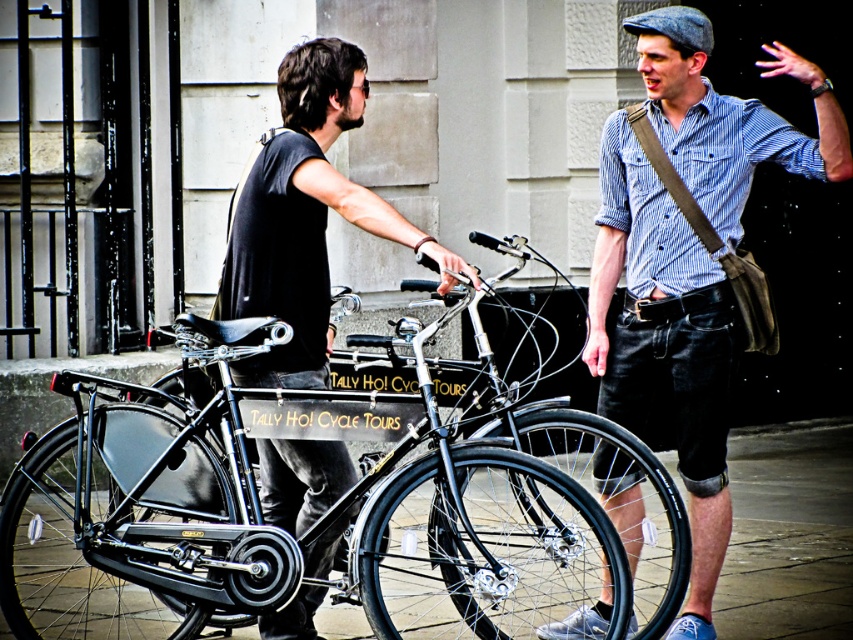
Consider the image. You are a delivery person who needs to choose between the black matte bicycle at center and the matte black bicycle at center for a delivery job that requires reaching high speeds. Which bicycle would be more suitable based on their height?

The black matte bicycle at center is much taller than the matte black bicycle at center. Taller bicycles typically have a more upright riding position, which can be less aerodynamic and may not be ideal for high speeds. Therefore, the matte black bicycle at center, being shorter, might offer a more aerodynamic posture and could be better suited for reaching higher speeds.

You are a delivery person who needs to park your bicycle. The parking area has a space that can only accommodate objects smaller than the black rubber pavement at lower center. Can your black matte bicycle at center fit in that space?

The black matte bicycle at center is bigger than the black rubber pavement at lower center, so it cannot fit in the parking space designated for smaller objects.